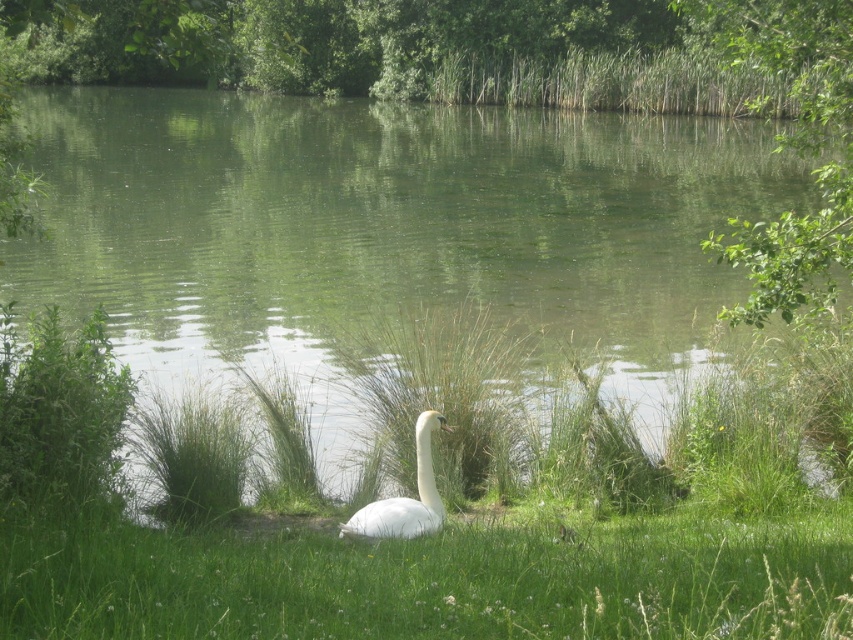
You are a photographer standing at the edge of the pond where the swan is resting. You want to take a photo that includes both the swan and the reflection of the trees. To do this, you need to position yourself so that the point at coordinate point (15,449) is between you and the point at coordinate point (432,488). Is this possible based on the scene?

Yes, because point (15,449) is in front of point (432,488), so positioning yourself behind point (15,449) would allow both points to be visible in the frame with the first point blocking the second if aligned directly, but since you want both in the photo, adjusting the angle slightly would ensure both are captured without obstruction.

Consider the image. You are a photographer aiming to capture the white feathered swan at center in your shot. The green water at center is reflecting the surroundings. Which object takes up more space in the image?

The green water at center takes up more space in the image as it has a larger size compared to the white feathered swan at center.